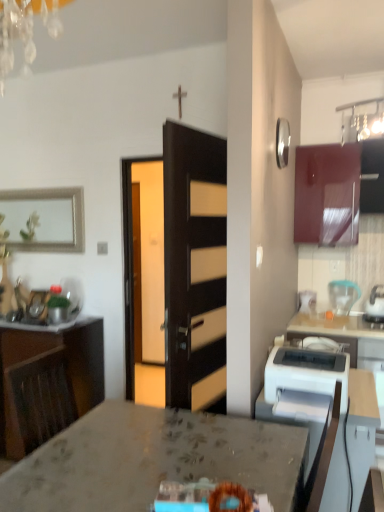
The image size is (384, 512). Describe the element at coordinates (327, 194) in the screenshot. I see `glossy wood cabinet at upper right, acting as the 2th cabinetry starting from the bottom` at that location.

In order to face translucent plastic blender at right, marked as the 1th kitchen appliance in a back-to-front arrangement, should I rotate leftwards or rightwards?

Turn right approximately 19.386 degrees to face it.

Find the location of a particular element. The height and width of the screenshot is (512, 384). white glossy kettle at upper right, the second kitchen appliance from the back is located at coordinates (375, 305).

Image resolution: width=384 pixels, height=512 pixels. Find the location of `white glossy table at lower right`. white glossy table at lower right is located at coordinates (362, 422).

Image resolution: width=384 pixels, height=512 pixels. What do you see at coordinates (153, 460) in the screenshot? I see `marble countertop at center` at bounding box center [153, 460].

The image size is (384, 512). In order to click on glossy wood cabinet at upper right, placed as the first cabinetry when sorted from right to left in this screenshot , I will do `click(327, 194)`.

Is silver metallic picture frame at upper left in contact with glossy wood cabinet at upper right, acting as the 2th cabinetry starting from the bottom?

No, silver metallic picture frame at upper left is not beside glossy wood cabinet at upper right, acting as the 2th cabinetry starting from the bottom.

Is silver metallic picture frame at upper left bigger than glossy wood cabinet at upper right, which is the first cabinetry in top-to-bottom order?

Incorrect, silver metallic picture frame at upper left is not larger than glossy wood cabinet at upper right, which is the first cabinetry in top-to-bottom order.

From a real-world perspective, which is physically above, silver metallic picture frame at upper left or glossy wood cabinet at upper right, which is the first cabinetry in top-to-bottom order?

glossy wood cabinet at upper right, which is the first cabinetry in top-to-bottom order, is physically above.

Does silver metallic picture frame at upper left appear on the right side of glossy wood cabinet at upper right, acting as the 2th cabinetry starting from the bottom?

Incorrect, silver metallic picture frame at upper left is not on the right side of glossy wood cabinet at upper right, acting as the 2th cabinetry starting from the bottom.

From the image's perspective, is glossy wood cabinet at upper right, which is the first cabinetry in top-to-bottom order, on dark wood door at center?

Yes.

Are glossy wood cabinet at upper right, which is the first cabinetry in top-to-bottom order, and dark wood door at center far apart?

Yes.

How much distance is there between glossy wood cabinet at upper right, which is the first cabinetry in top-to-bottom order, and dark wood door at center?

A distance of 3.96 feet exists between glossy wood cabinet at upper right, which is the first cabinetry in top-to-bottom order, and dark wood door at center.

Is glossy wood cabinet at upper right, which is the first cabinetry in top-to-bottom order, wider than dark wood door at center?

Yes.

Considering the positions of point (306, 350) and point (340, 290), is point (306, 350) closer or farther from the camera than point (340, 290)?

Point (306, 350).

How far apart are white plastic printer at right and translucent plastic blender at right, marked as the 1th kitchen appliance in a back-to-front arrangement?

white plastic printer at right is 4.67 feet from translucent plastic blender at right, marked as the 1th kitchen appliance in a back-to-front arrangement.

In the image, is white plastic printer at right positioned in front of or behind translucent plastic blender at right, marked as the second kitchen appliance in a front-to-back arrangement?

Visually, white plastic printer at right is located in front of translucent plastic blender at right, marked as the second kitchen appliance in a front-to-back arrangement.

Is white plastic printer at right surrounding translucent plastic blender at right, marked as the 1th kitchen appliance in a back-to-front arrangement?

Definitely not — translucent plastic blender at right, marked as the 1th kitchen appliance in a back-to-front arrangement, is not inside white plastic printer at right.

Which of these two, silver metallic picture frame at upper left or marble countertop at center, is wider?

→ marble countertop at center is wider.

Is silver metallic picture frame at upper left oriented towards marble countertop at center?

No, silver metallic picture frame at upper left is not turned towards marble countertop at center.

Is silver metallic picture frame at upper left with marble countertop at center?

No, silver metallic picture frame at upper left is not in contact with marble countertop at center.

In the image, is silver metallic picture frame at upper left positioned in front of or behind marble countertop at center?

Clearly, silver metallic picture frame at upper left is behind marble countertop at center.

From a real-world perspective, is white plastic printer at right physically below glossy wood cabinet at upper right, placed as the first cabinetry when sorted from right to left?

Correct, in the physical world, white plastic printer at right is lower than glossy wood cabinet at upper right, placed as the first cabinetry when sorted from right to left.

Based on their positions, is white plastic printer at right located to the left or right of glossy wood cabinet at upper right, which is the second cabinetry from left to right?

Based on their positions, white plastic printer at right is located to the left of glossy wood cabinet at upper right, which is the second cabinetry from left to right.

Is point (321, 375) closer or farther from the camera than point (306, 179)?

Point (321, 375).

Between white glossy table at lower right and translucent plastic blender at right, marked as the 1th kitchen appliance in a back-to-front arrangement, which one is positioned in front?

Positioned in front is white glossy table at lower right.

What's the angular difference between white glossy table at lower right and translucent plastic blender at right, marked as the second kitchen appliance in a front-to-back arrangement,'s facing directions?

90.4 degrees separate the facing orientations of white glossy table at lower right and translucent plastic blender at right, marked as the second kitchen appliance in a front-to-back arrangement.

Which of these two, white glossy table at lower right or translucent plastic blender at right, marked as the second kitchen appliance in a front-to-back arrangement, is wider?

white glossy table at lower right.

Is point (270, 406) farther from camera compared to point (336, 282)?

No, it is in front of (336, 282).

From the image's perspective, relative to white plastic printer at right, is marble countertop at center above or below?

From the image's perspective, marble countertop at center appears below white plastic printer at right.

The image size is (384, 512). In order to click on appliance to the right of marble countertop at center in this screenshot , I will do `click(305, 373)`.

Between marble countertop at center and white plastic printer at right, which one appears on the right side from the viewer's perspective?

white plastic printer at right.

The width and height of the screenshot is (384, 512). What are the coordinates of `picture frame to the left of glossy wood cabinet at upper right, which is the first cabinetry in top-to-bottom order` in the screenshot? It's located at (45, 219).

This screenshot has height=512, width=384. In order to click on cabinetry above the dark wood door at center (from a real-world perspective) in this screenshot , I will do `click(327, 194)`.

Based on their spatial positions, is dark wood door at center or translucent plastic blender at right, marked as the 1th kitchen appliance in a back-to-front arrangement, closer to wooden cabinet at left, placed as the first cabinetry when sorted from left to right?

dark wood door at center.

When comparing their distances from white plastic printer at right, does translucent plastic blender at right, marked as the 1th kitchen appliance in a back-to-front arrangement, or glossy wood cabinet at upper right, placed as the first cabinetry when sorted from right to left, seem closer?

glossy wood cabinet at upper right, placed as the first cabinetry when sorted from right to left, is positioned closer to the anchor white plastic printer at right.

Based on their spatial positions, is translucent plastic blender at right, marked as the 1th kitchen appliance in a back-to-front arrangement, or marble countertop at center closer to dark wood door at center?

marble countertop at center is closer to dark wood door at center.

Which object lies further to the anchor point white glossy table at lower right, silver metallic picture frame at upper left or marble countertop at center?

silver metallic picture frame at upper left lies further to white glossy table at lower right than the other object.

Estimate the real-world distances between objects in this image. Which object is closer to silver metallic picture frame at upper left, white glossy table at lower right or translucent plastic blender at right, marked as the 1th kitchen appliance in a back-to-front arrangement?

Based on the image, translucent plastic blender at right, marked as the 1th kitchen appliance in a back-to-front arrangement, appears to be nearer to silver metallic picture frame at upper left.

From the image, which object appears to be farther from white plastic printer at right, white glossy kettle at upper right, the second kitchen appliance from the back, or silver metallic picture frame at upper left?

silver metallic picture frame at upper left.

From the picture: Considering their positions, is marble countertop at center positioned closer to glossy wood cabinet at upper right, placed as the first cabinetry when sorted from right to left, than white glossy kettle at upper right, acting as the first kitchen appliance starting from the front?

white glossy kettle at upper right, acting as the first kitchen appliance starting from the front, is closer to glossy wood cabinet at upper right, placed as the first cabinetry when sorted from right to left.

Which object lies further to the anchor point marble countertop at center, wooden cabinet at left, placed as the first cabinetry when sorted from left to right, or dark wood door at center?

wooden cabinet at left, placed as the first cabinetry when sorted from left to right.

Where is `door between wooden cabinet at left, placed as the second cabinetry when sorted from right to left, and white glossy table at lower right from left to right`? The height and width of the screenshot is (512, 384). door between wooden cabinet at left, placed as the second cabinetry when sorted from right to left, and white glossy table at lower right from left to right is located at coordinates point(194,265).

Find the location of a particular element. The height and width of the screenshot is (512, 384). door between marble countertop at center and silver metallic picture frame at upper left from front to back is located at coordinates (194, 265).

Identify the location of door that lies between glossy wood cabinet at upper right, which is the first cabinetry in top-to-bottom order, and white glossy table at lower right from top to bottom. (194, 265).

Locate an element on the screen. This screenshot has height=512, width=384. cabinetry between silver metallic picture frame at upper left and translucent plastic blender at right, marked as the 1th kitchen appliance in a back-to-front arrangement, in the horizontal direction is located at coordinates (327, 194).